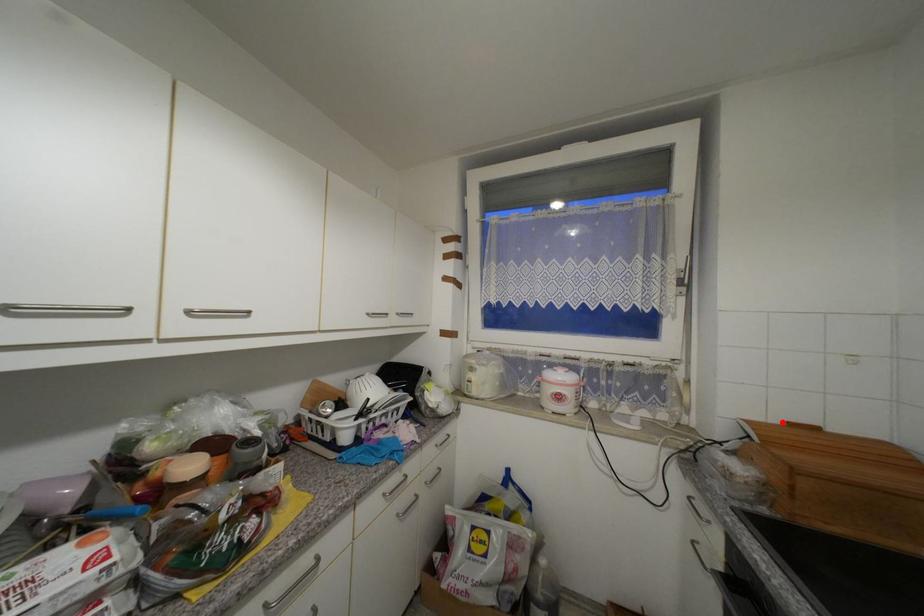
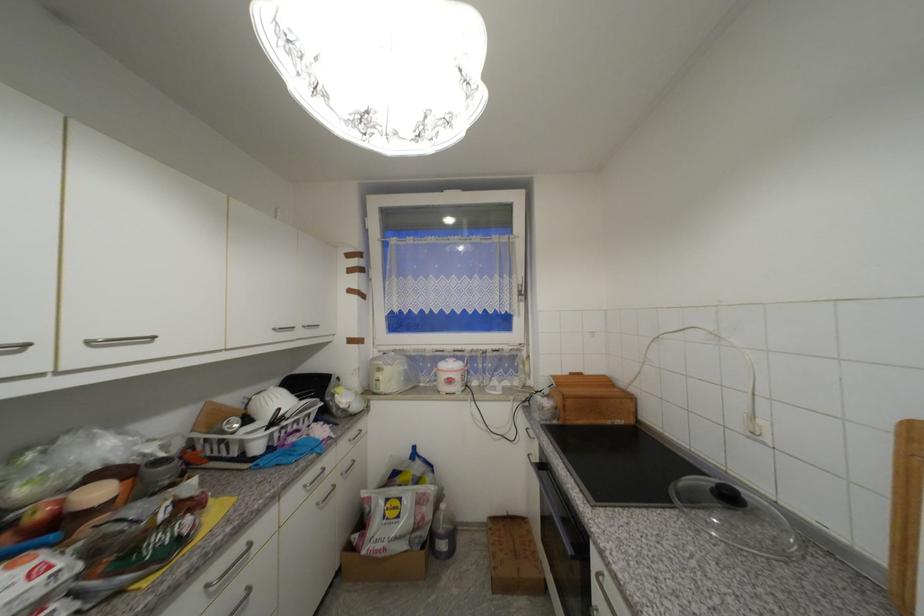
Question: I am providing you with two images of the same scene from different viewpoints. A red point is marked on the first image. At the location where the point appears in image 1, is it still visible in image 2?

Choices:
 (A) Yes
 (B) No

Answer: (A)